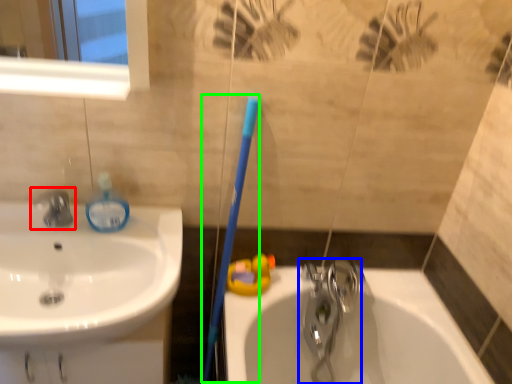
Question: Considering the real-world distances, which object is farthest from tap (highlighted by a red box)? tap (highlighted by a blue box) or toothbrush (highlighted by a green box)?

Choices:
 (A) tap
 (B) toothbrush

Answer: (A)